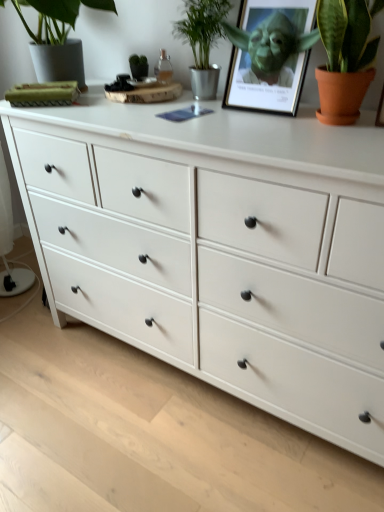
Locate an element on the screen. This screenshot has width=384, height=512. vacant region to the left of matte green picture frame at upper center is located at coordinates (200, 114).